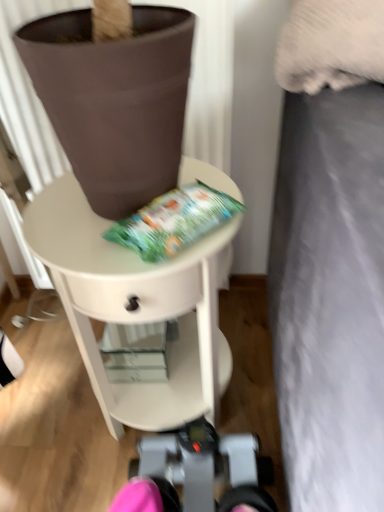
What is the approximate width of white glossy table at center?

white glossy table at center is 13.82 inches wide.

The width and height of the screenshot is (384, 512). What do you see at coordinates (136, 307) in the screenshot?
I see `white glossy table at center` at bounding box center [136, 307].

This screenshot has width=384, height=512. I want to click on white glossy table at center, so click(136, 307).

The width and height of the screenshot is (384, 512). Identify the location of white glossy table at center. (136, 307).